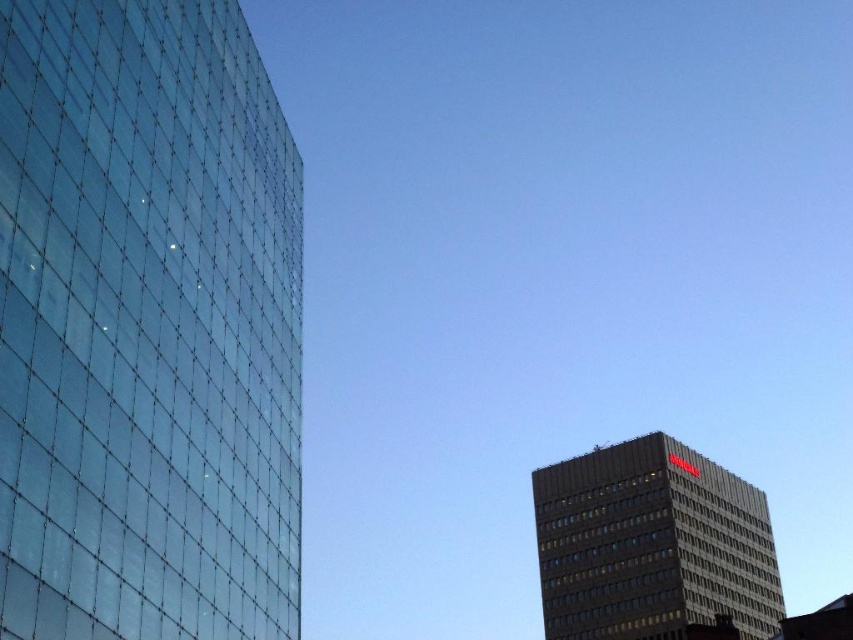
Question: Does transparent glass building at left have a lesser width compared to dark gray concrete building at lower right?

Choices:
 (A) no
 (B) yes

Answer: (B)

Question: Does transparent glass building at left have a lesser width compared to dark gray concrete building at lower right?

Choices:
 (A) yes
 (B) no

Answer: (A)

Question: Which point is farther to the camera?

Choices:
 (A) dark gray concrete building at lower right
 (B) transparent glass building at left

Answer: (A)

Question: From the image, what is the correct spatial relationship of transparent glass building at left in relation to dark gray concrete building at lower right?

Choices:
 (A) left
 (B) right

Answer: (A)

Question: Among these objects, which one is nearest to the camera?

Choices:
 (A) transparent glass building at left
 (B) dark gray concrete building at lower right

Answer: (A)